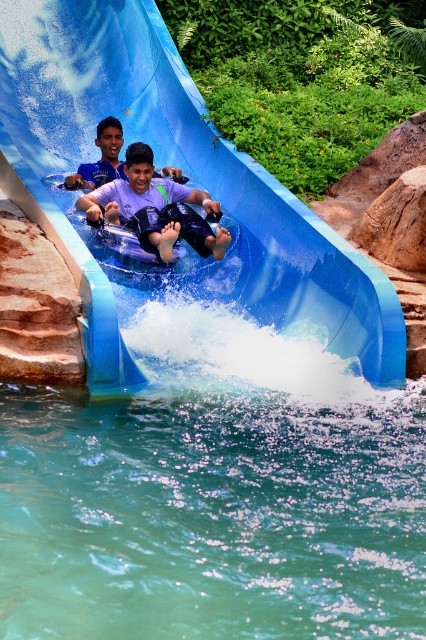
You are standing at point (x=196, y=216) and want to reach the water slide. The park requires that you maintain a minimum distance of 10 meters from all water slides for safety. Can you safely approach the water slide from your current position?

The distance between you and the water slide is 9.48 meters, which is less than the required 10 meters. Therefore, you cannot safely approach the water slide from your current position without violating the safety distance.

You are at the water park and want to ensure safety before sliding down the blue rubber slide at center. Since the purple matte life vest at center is mandatory, where should you put it relative to the slide?

A: The blue rubber slide at center is above the purple matte life vest at center, so you should place the purple matte life vest at center below the blue rubber slide at center to ensure it is accessible when exiting the slide.

You are at the water park and see the blue rubber slide at center and the purple matte life vest at center. Which object is positioned to the left?

The blue rubber slide at center is to the left of the purple matte life vest at center.